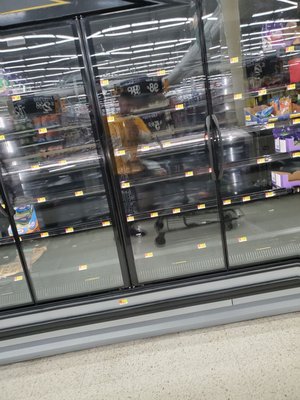
Where is `cardboard display boxes`? The height and width of the screenshot is (400, 300). cardboard display boxes is located at coordinates (266, 45), (246, 113), (287, 117), (281, 149), (281, 179), (30, 223).